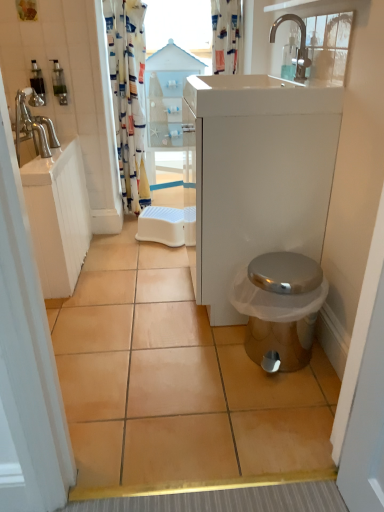
Question: Relative to translucent plastic soap dispenser at upper left, acting as the first toiletry starting from the left, is transparent plastic window screen at upper center in front or behind?

Choices:
 (A) behind
 (B) front

Answer: (A)

Question: Is point (210, 15) closer or farther from the camera than point (36, 69)?

Choices:
 (A) farther
 (B) closer

Answer: (A)

Question: Which of these objects is positioned farthest from the translucent plastic soap dispenser at upper left, acting as the 2th toiletry starting from the left?

Choices:
 (A) printed fabric shower curtain at upper left, marked as the first shower curtain in a left-to-right arrangement
 (B) metallic silver toilet at lower right
 (C) printed fabric shower curtain at upper center, which is the 1th shower curtain in right-to-left order
 (D) translucent plastic soap dispenser at upper left, acting as the first toiletry starting from the left
 (E) silver metallic faucet at upper center

Answer: (B)

Question: Which object is positioned closest to the beige ceramic tile at center?

Choices:
 (A) transparent wood cabinet at center
 (B) printed fabric shower curtain at upper center, which appears as the 2th shower curtain when viewed from the left
 (C) translucent plastic soap dispenser at upper left, positioned as the second toiletry in right-to-left order
 (D) white glossy sink at upper center
 (E) translucent plastic soap dispenser at upper left, which is the 1th toiletry in right-to-left order

Answer: (D)